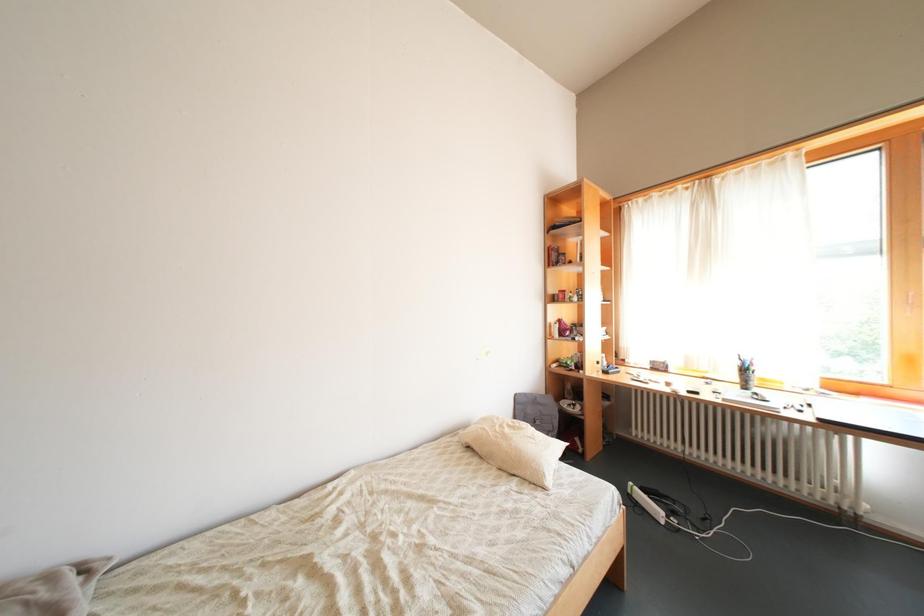
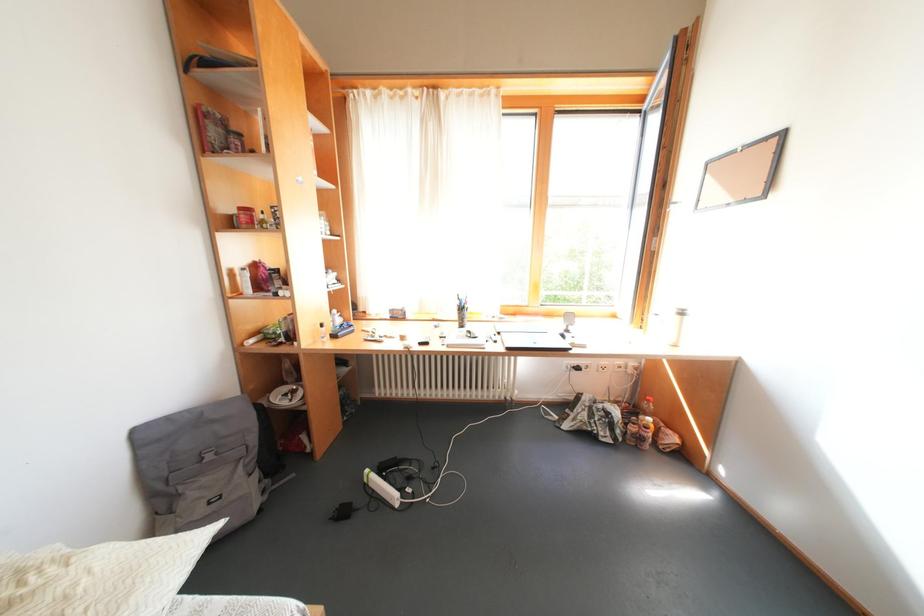
Question: How did the camera likely rotate?

Choices:
 (A) Left
 (B) Right
 (C) Up
 (D) Down

Answer: (B)